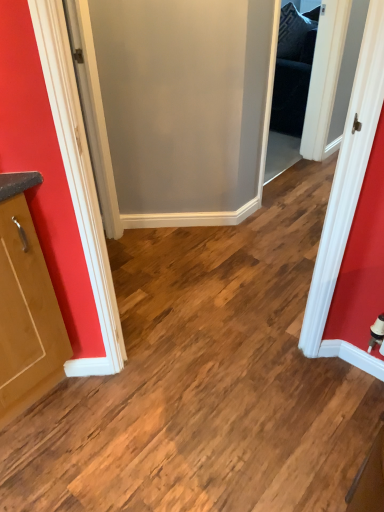
This screenshot has width=384, height=512. I want to click on free point below dark gray fabric screen door at upper right (from a real-world perspective), so click(288, 177).